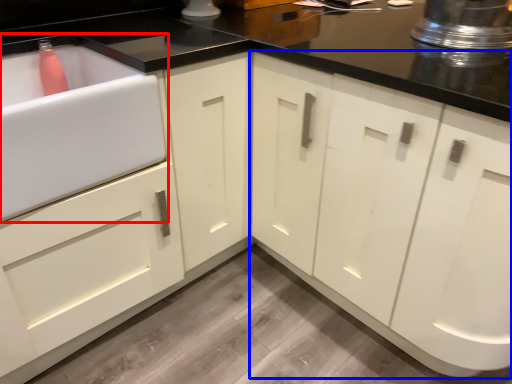
Question: Which of the following is the farthest to the observer, sink (highlighted by a red box) or cabinetry (highlighted by a blue box)?

Choices:
 (A) sink
 (B) cabinetry

Answer: (A)